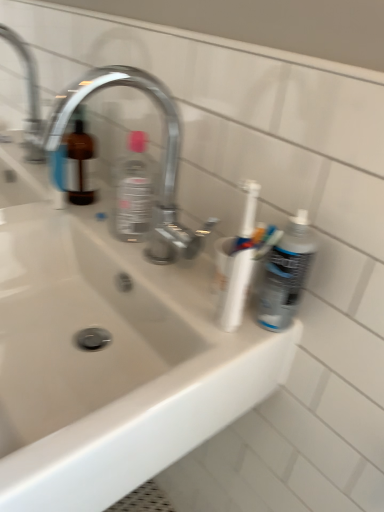
Describe the element at coordinates (28, 95) in the screenshot. I see `chrome metallic faucet at upper left` at that location.

I want to click on chrome metallic faucet at upper left, so click(x=28, y=95).

I want to click on chrome metallic faucet at upper left, so click(x=28, y=95).